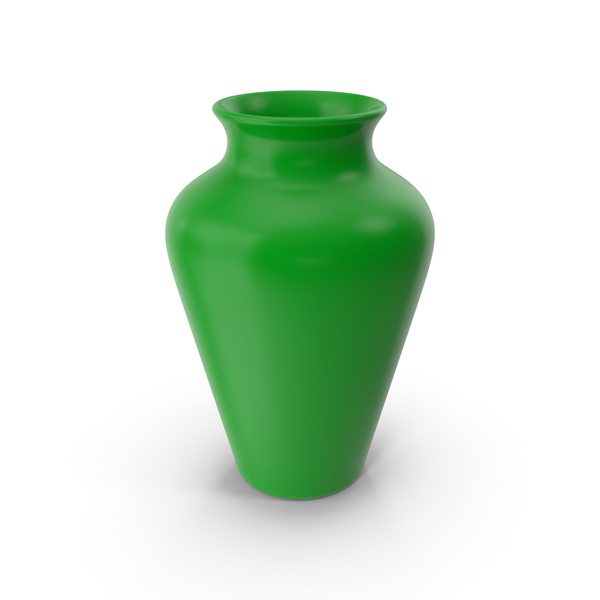
The width and height of the screenshot is (600, 600). In order to click on vase in this screenshot , I will do `click(313, 450)`.